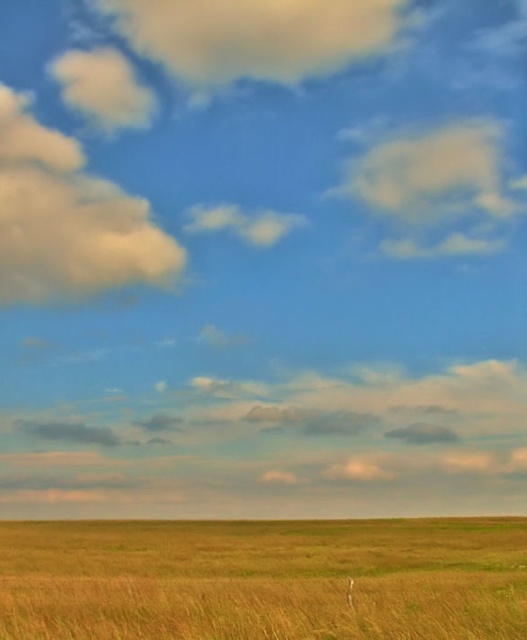
You are a bird soaring above the golden grass field. You notice two clouds in the sky. Which one is positioned to the left of the other, the cloudy sky at upper left or the cloudy cotton cloud at upper right?

The cloudy sky at upper left is positioned to the left of the cloudy cotton cloud at upper right.

You are an airplane pilot preparing for takeoff and you observe the cloudy sky at upper center and the cloudy cotton cloud at upper right. Which of these two clouds has a greater width?

The cloudy sky at upper center has a greater width than the cloudy cotton cloud at upper right.